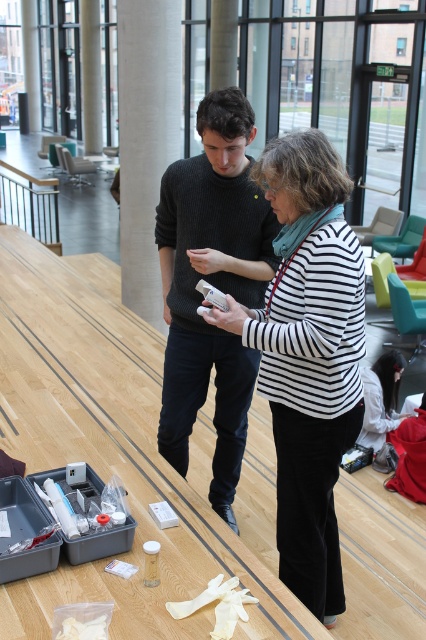
Question: Does white fabric shirt at lower right have a smaller size compared to white plastic bag at lower left?

Choices:
 (A) no
 (B) yes

Answer: (A)

Question: Does white fabric shirt at lower right have a greater width compared to white plastic bag at lower left?

Choices:
 (A) yes
 (B) no

Answer: (A)

Question: Among these objects, which one is farthest from the camera?

Choices:
 (A) white smooth pillar at center
 (B) white striped sweater at center
 (C) satin silver pole at center
 (D) knitted dark gray sweater at center

Answer: (C)

Question: Does white smooth pillar at center appear over satin silver pole at center?

Choices:
 (A) no
 (B) yes

Answer: (A)

Question: Which object is closer to the camera taking this photo?

Choices:
 (A) white plastic bag at lower left
 (B) white fabric shirt at lower right

Answer: (A)

Question: Which point is closer to the camera?

Choices:
 (A) (302, 563)
 (B) (83, 6)
 (C) (256, 198)

Answer: (A)